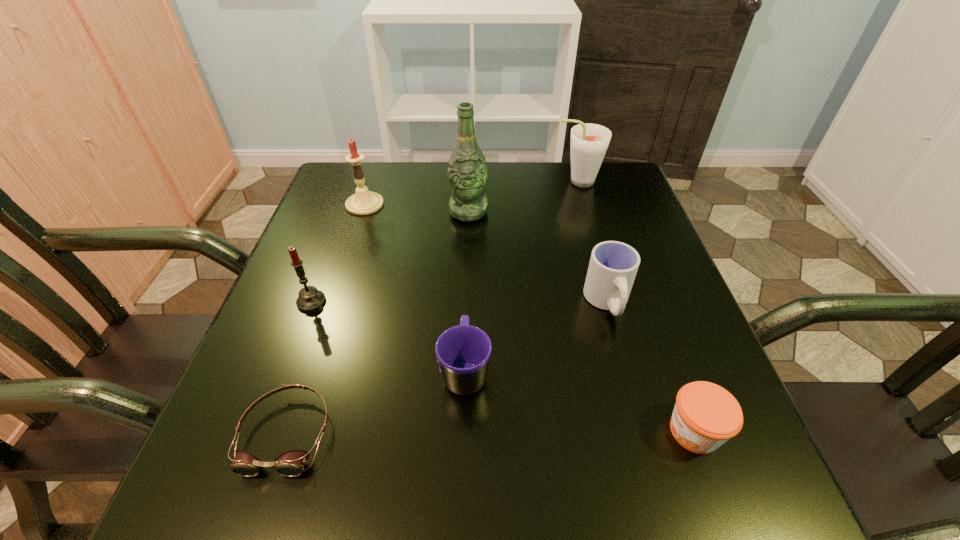
The width and height of the screenshot is (960, 540). I want to click on the tallest object, so click(467, 174).

The image size is (960, 540). Find the location of `the farthest object`. the farthest object is located at coordinates (589, 142).

This screenshot has height=540, width=960. Find the location of `the farther candle`. the farther candle is located at coordinates (364, 202).

Where is `the fourth tallest object`? the fourth tallest object is located at coordinates (310, 299).

Image resolution: width=960 pixels, height=540 pixels. In order to click on the shorter candle in this screenshot , I will do `click(310, 299)`.

Locate an element on the screen. Image resolution: width=960 pixels, height=540 pixels. cup is located at coordinates (613, 266).

You are a GUI agent. You are given a task and a screenshot of the screen. Output one action in this format:
    pyautogui.click(x=<x>, y=<y>)
    Task: Click on the mug
    The height and width of the screenshot is (540, 960).
    Given the screenshot: What is the action you would take?
    pyautogui.click(x=463, y=352)

Where is `the seventh tallest object`? This screenshot has height=540, width=960. the seventh tallest object is located at coordinates (705, 416).

This screenshot has width=960, height=540. I want to click on goggles, so click(291, 463).

Locate an element on the screen. Image resolution: width=960 pixels, height=540 pixels. vacant space located 0.160m on the surface of the tallest object is located at coordinates (467, 269).